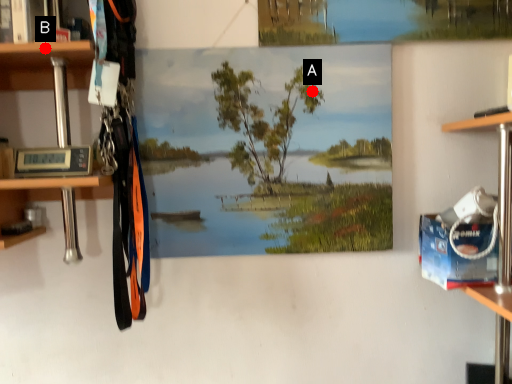
Question: Two points are circled on the image, labeled by A and B beside each circle. Which point is closer to the camera?

Choices:
 (A) A is closer
 (B) B is closer

Answer: (B)